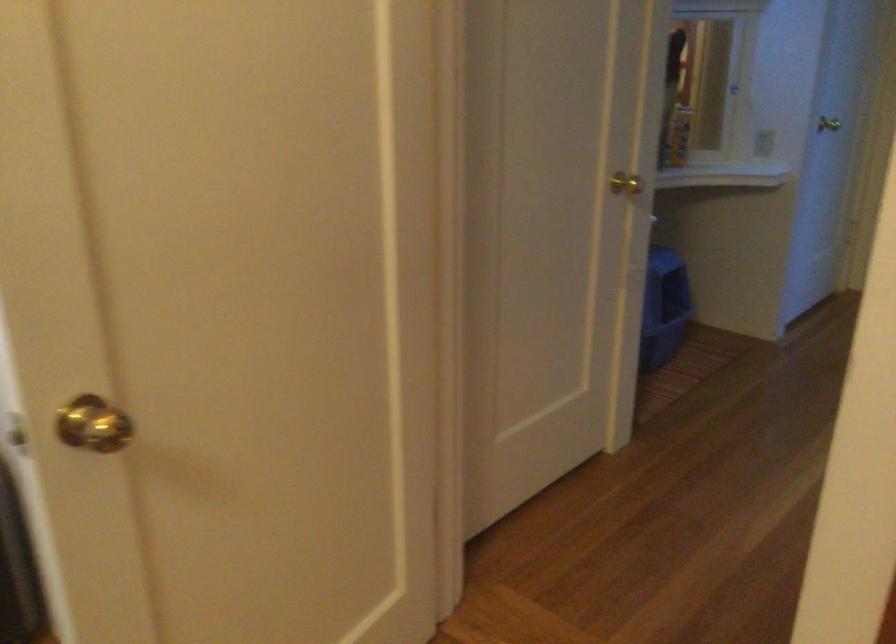
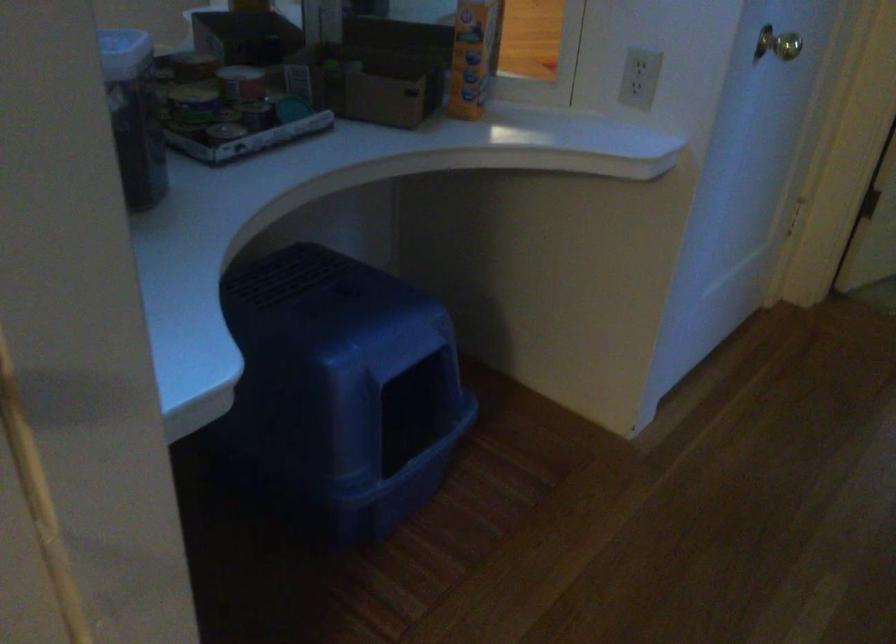
Find the pixel in the second image that matches (x=664, y=308) in the first image.

(451, 371)